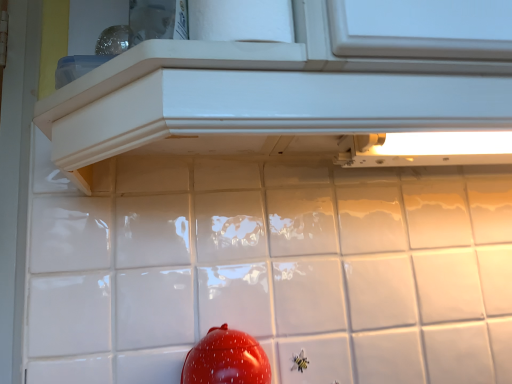
Question: Could you tell me if white glossy cabinet at upper center is turned towards glossy red tomato at lower center?

Choices:
 (A) yes
 (B) no

Answer: (B)

Question: Is white glossy cabinet at upper center positioned with its back to glossy red tomato at lower center?

Choices:
 (A) yes
 (B) no

Answer: (B)

Question: From a real-world perspective, is white glossy cabinet at upper center positioned over glossy red tomato at lower center based on gravity?

Choices:
 (A) yes
 (B) no

Answer: (A)

Question: Considering the relative positions of white glossy cabinet at upper center and glossy red tomato at lower center in the image provided, is white glossy cabinet at upper center behind glossy red tomato at lower center?

Choices:
 (A) yes
 (B) no

Answer: (B)

Question: Is white glossy cabinet at upper center shorter than glossy red tomato at lower center?

Choices:
 (A) yes
 (B) no

Answer: (A)

Question: From a real-world perspective, is white glossy cabinet at upper center positioned under glossy red tomato at lower center based on gravity?

Choices:
 (A) no
 (B) yes

Answer: (A)

Question: Is the position of glossy red tomato at lower center more distant than that of white glossy cabinet at upper center?

Choices:
 (A) yes
 (B) no

Answer: (A)

Question: From a real-world perspective, is glossy red tomato at lower center below white glossy cabinet at upper center?

Choices:
 (A) no
 (B) yes

Answer: (B)

Question: Is glossy red tomato at lower center to the left of white glossy cabinet at upper center from the viewer's perspective?

Choices:
 (A) no
 (B) yes

Answer: (A)

Question: Is glossy red tomato at lower center oriented away from white glossy cabinet at upper center?

Choices:
 (A) no
 (B) yes

Answer: (A)

Question: Does glossy red tomato at lower center have a larger size compared to white glossy cabinet at upper center?

Choices:
 (A) yes
 (B) no

Answer: (B)

Question: Is glossy red tomato at lower center positioned beyond the bounds of white glossy cabinet at upper center?

Choices:
 (A) yes
 (B) no

Answer: (A)

Question: From a real-world perspective, relative to glossy red tomato at lower center, is white glossy cabinet at upper center vertically above or below?

Choices:
 (A) below
 (B) above

Answer: (B)